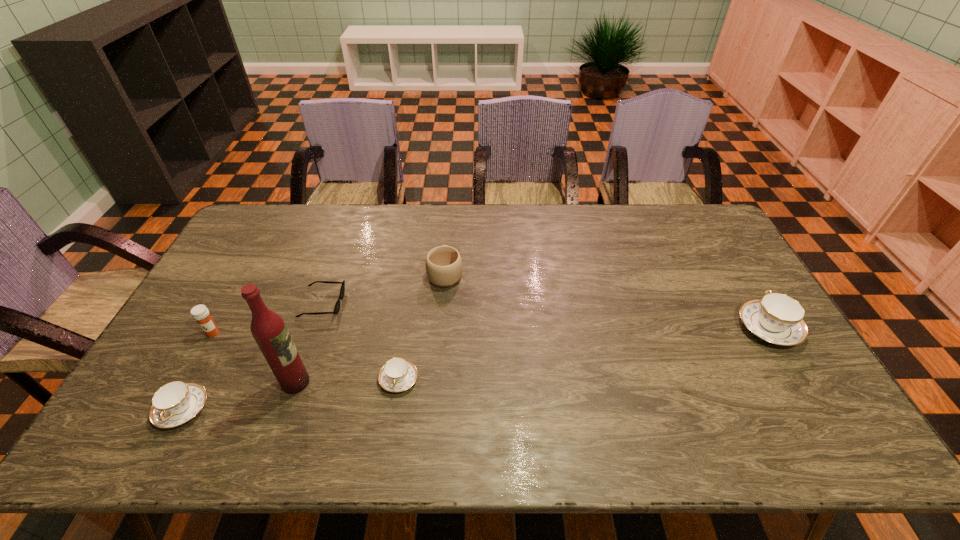
Where is `free space between the rightmost teacup and the tallest object`? free space between the rightmost teacup and the tallest object is located at coordinates (532, 355).

I want to click on free space between the leftmost teacup and the liquor, so click(239, 396).

Where is `vacant point located between the farthest teacup and the tallest object`? vacant point located between the farthest teacup and the tallest object is located at coordinates (532, 355).

What are the coordinates of `vacant space that is in between the second teacup from right to left and the fifth tallest object` in the screenshot? It's located at (291, 394).

Where is `unoccupied area between the mug and the farthest teacup`? The width and height of the screenshot is (960, 540). unoccupied area between the mug and the farthest teacup is located at coordinates 607,301.

Find the location of a particular element. vacant region between the medicine and the tallest object is located at coordinates pos(254,357).

Where is `free space between the medicine and the mug`? This screenshot has height=540, width=960. free space between the medicine and the mug is located at coordinates (329, 303).

Locate an element on the screen. empty space between the tallest object and the second shortest teacup is located at coordinates (239, 396).

Locate which object is the second closest to the rightmost teacup. Please provide its 2D coordinates. Your answer should be formatted as a tuple, i.e. [(x, y)], where the tuple contains the x and y coordinates of a point satisfying the conditions above.

[(398, 374)]

Identify which object is the second nearest to the medicine. Please provide its 2D coordinates. Your answer should be formatted as a tuple, i.e. [(x, y)], where the tuple contains the x and y coordinates of a point satisfying the conditions above.

[(337, 306)]